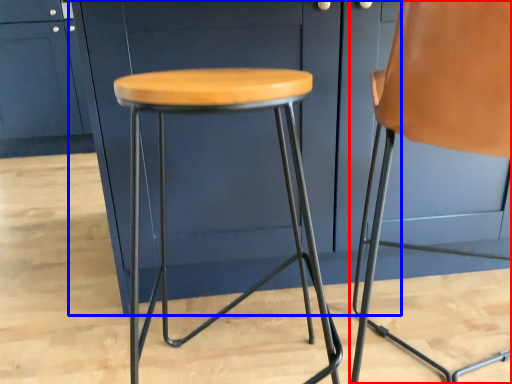
Question: Which object is closer to the camera taking this photo, chair (highlighted by a red box) or cabinetry (highlighted by a blue box)?

Choices:
 (A) chair
 (B) cabinetry

Answer: (A)